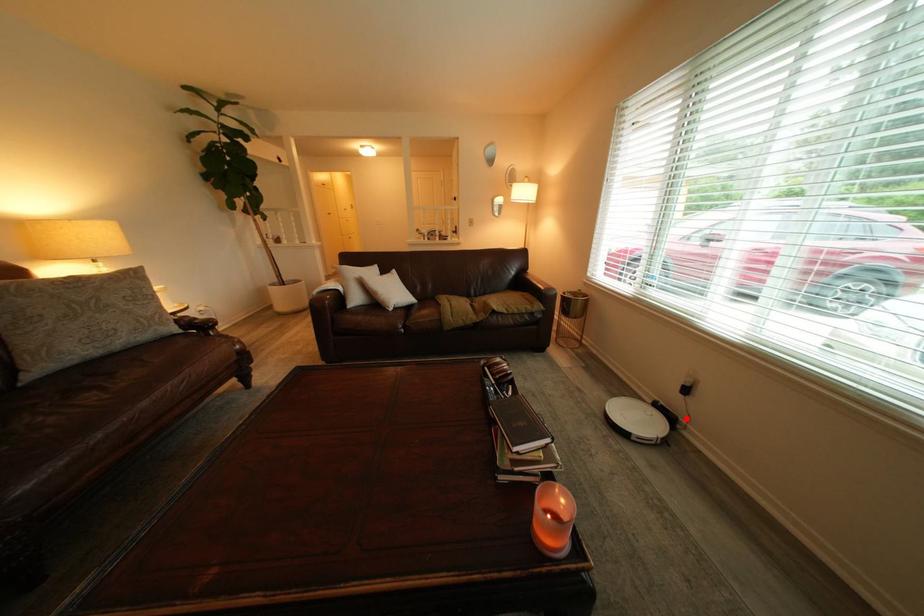
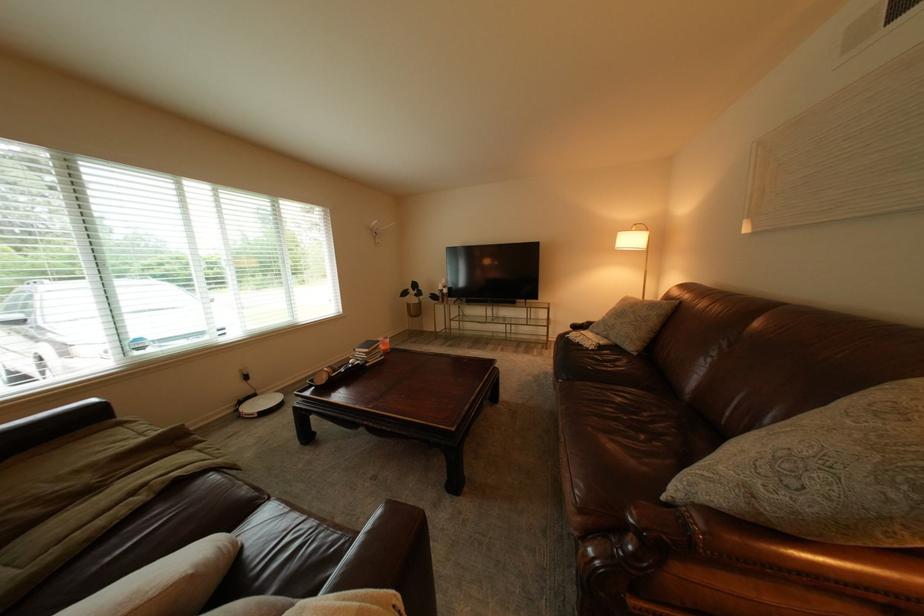
Locate, in the second image, the point that corresponds to the highlighted location in the first image.

(269, 397)